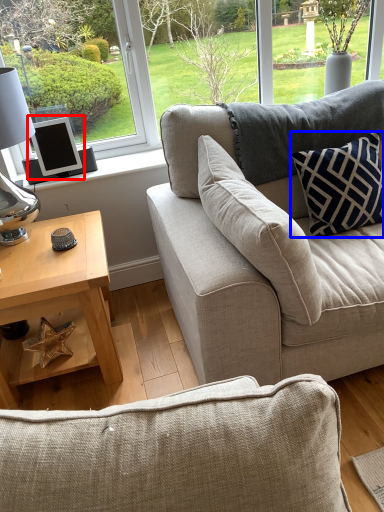
Question: Which point is further to the camera, computer monitor (highlighted by a red box) or pillow (highlighted by a blue box)?

Choices:
 (A) computer monitor
 (B) pillow

Answer: (A)